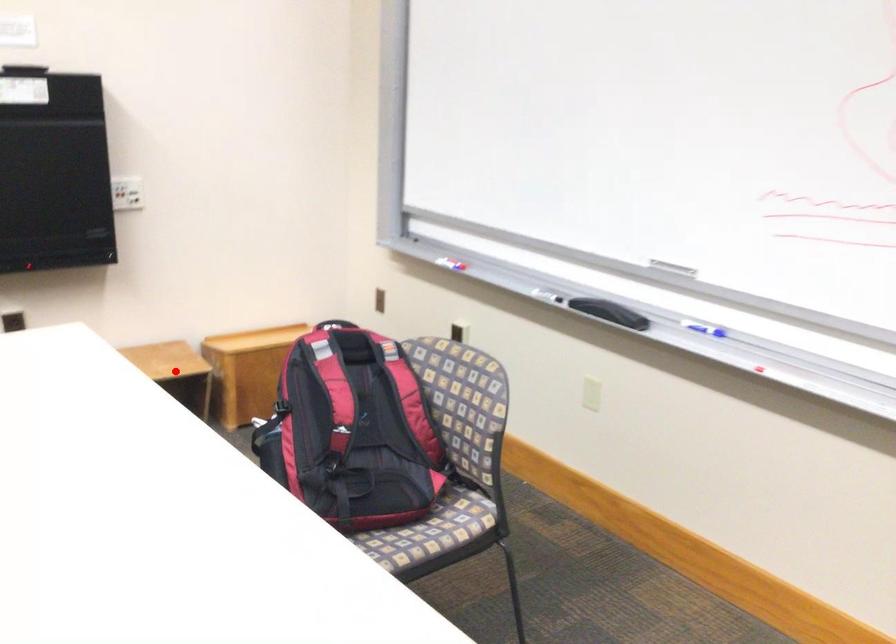
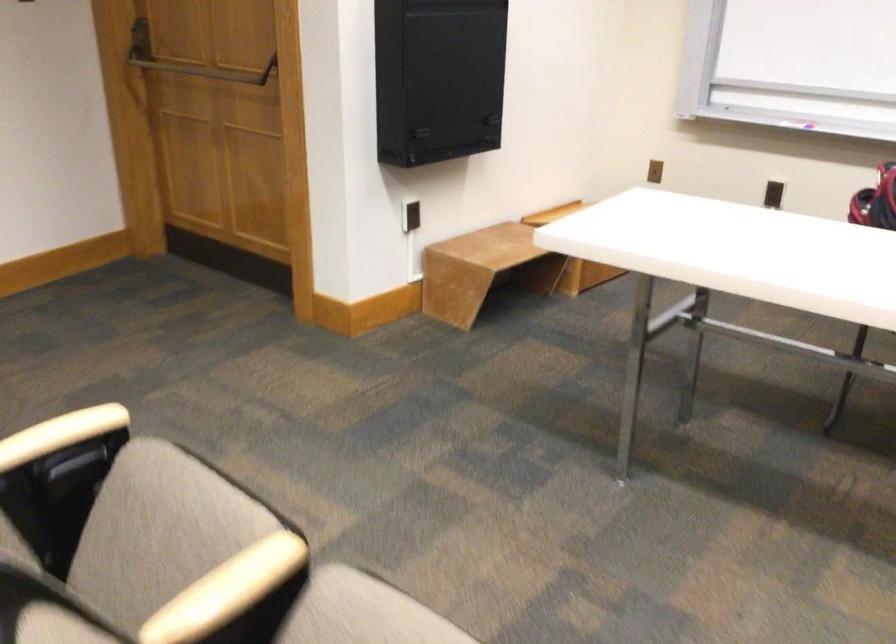
Question: I am providing you with two images of the same scene from different viewpoints. A red point is marked on the first image. At the location where the point appears in image 1, is it still visible in image 2?

Choices:
 (A) Yes
 (B) No

Answer: (B)